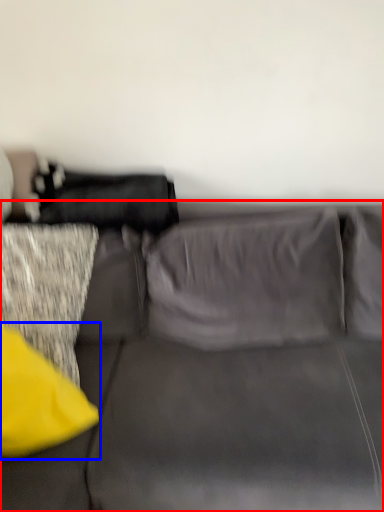
Question: Which object appears farthest to the camera in this image, studio couch (highlighted by a red box) or pillow (highlighted by a blue box)?

Choices:
 (A) studio couch
 (B) pillow

Answer: (B)